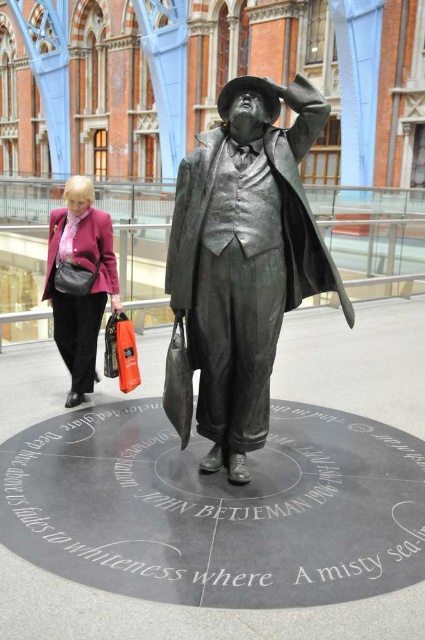
You are an artist planning to paint the scene in front of you. You notice the bronze statue at center and the matte pink blazer at left. Which object should you focus on first if you want to paint the larger object first?

The bronze statue at center is bigger than the matte pink blazer at left, so you should focus on painting the bronze statue at center first.

You are an art student standing in front of the bronze statue at center and the matte pink blazer at left. You want to sketch both items. Which one should you start with to capture their full view without moving your position?

You should start with the bronze statue at center because it is positioned over the matte pink blazer at left, meaning the statue is in front and fully visible while the blazer might be partially obscured by the statue.